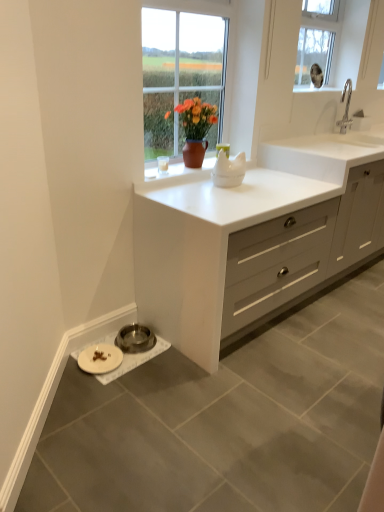
Identify the location of vacant space underneath white matte plate at lower left (from a real-world perspective). Image resolution: width=384 pixels, height=512 pixels. (106, 361).